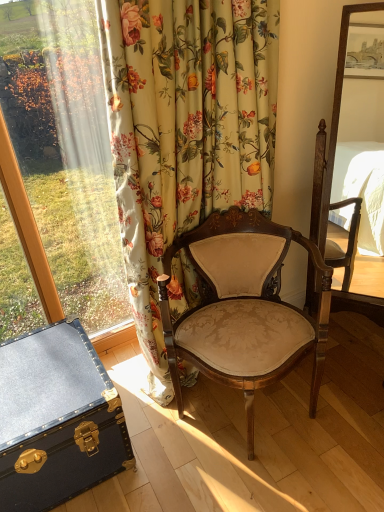
Where is `free space above blue leather trunk at lower left (from a real-world perspective)`? The image size is (384, 512). free space above blue leather trunk at lower left (from a real-world perspective) is located at coordinates (44, 374).